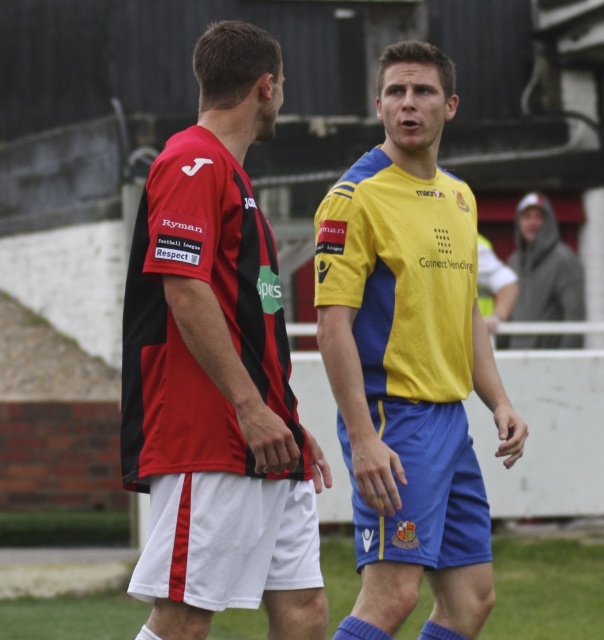
Question: Is green grass at lower center positioned at the back of gray hooded jacket at upper right?

Choices:
 (A) no
 (B) yes

Answer: (A)

Question: Based on their relative distances, which object is nearer to the gray hooded jacket at upper right?

Choices:
 (A) yellow matte jersey at center
 (B) matte black and red jersey at left
 (C) green grass at lower center

Answer: (C)

Question: Which point is closer to the camera taking this photo?

Choices:
 (A) (582, 285)
 (B) (417, 188)
 (C) (265, 577)

Answer: (C)

Question: Is matte black and red jersey at left bigger than gray hooded jacket at upper right?

Choices:
 (A) yes
 (B) no

Answer: (A)

Question: Which point is closer to the camera?

Choices:
 (A) (291, 513)
 (B) (454, 349)
 (C) (588, 582)

Answer: (A)

Question: Is matte black and red jersey at left behind gray hooded jacket at upper right?

Choices:
 (A) yes
 (B) no

Answer: (B)